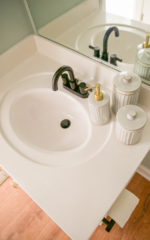
At what (x,y) coordinates should I click in order to perform the action: click on toilet paper holder. Please return your answer as a coordinate pair (x, y). Looking at the image, I should click on (109, 225).